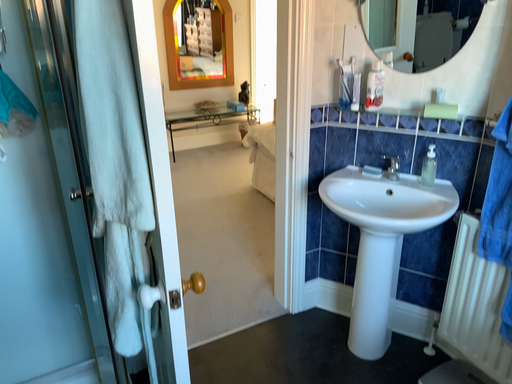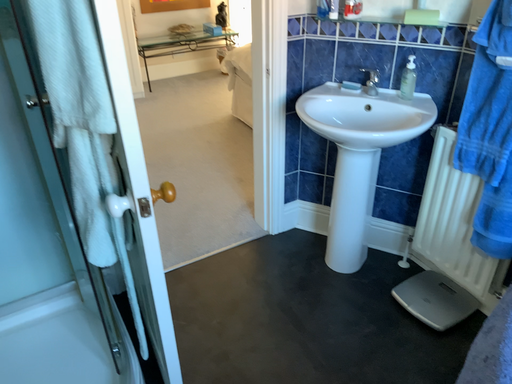
Question: Which way did the camera rotate in the video?

Choices:
 (A) rotated upward
 (B) rotated downward

Answer: (B)